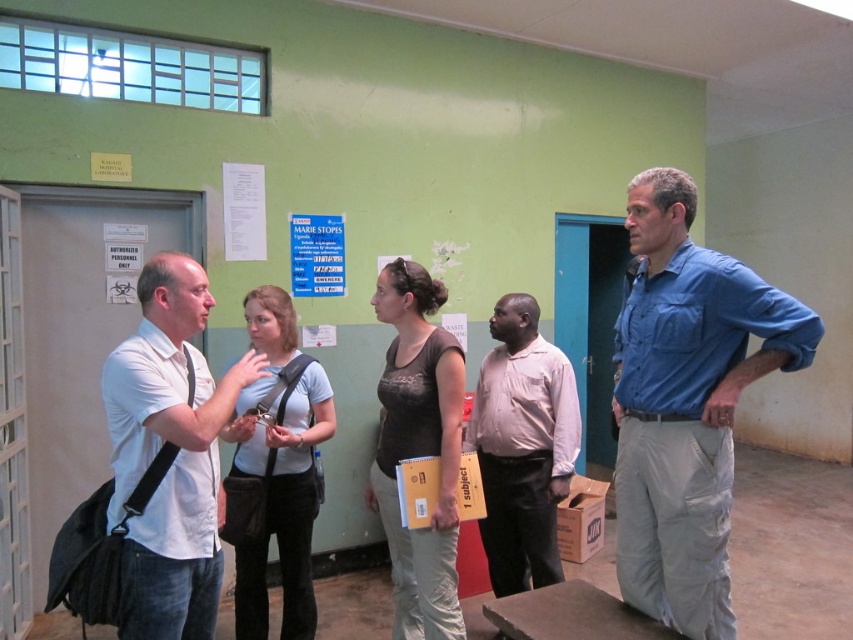
You are a healthcare worker in the room and need to quickly locate the person wearing the white matte shirt at left and the light brown shirt at center. Based on their positions, which shirt is closer to the entrance if the entrance is on the right side of the room?

The light brown shirt at center is closer to the entrance because the white matte shirt at left is to the left of light brown shirt at center, placing the light brown shirt closer to the right side where the entrance is located.

You are a healthcare worker entering the room and need to quickly identify the patient based on clothing. According to the scene, which individual is wearing the blue cotton shirt at center in relation to the white matte shirt at left?

The blue cotton shirt at center is above the white matte shirt at left, so the patient wearing the blue cotton shirt at center is positioned higher up than the one in the white matte shirt at left.